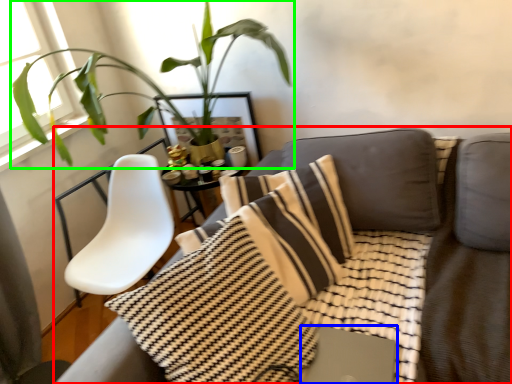
Question: Estimate the real-world distances between objects in this image. Which object is farther from studio couch (highlighted by a red box), computer (highlighted by a blue box) or houseplant (highlighted by a green box)?

Choices:
 (A) computer
 (B) houseplant

Answer: (B)